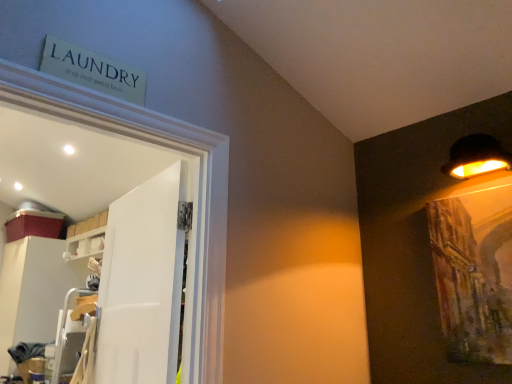
Question: Does white glossy cabinet at left contain white glossy shelf at upper left?

Choices:
 (A) yes
 (B) no

Answer: (B)

Question: Considering the relative positions of white glossy cabinet at left and white glossy shelf at upper left in the image provided, is white glossy cabinet at left to the right of white glossy shelf at upper left from the viewer's perspective?

Choices:
 (A) yes
 (B) no

Answer: (B)

Question: Considering the relative sizes of white glossy cabinet at left and white glossy shelf at upper left in the image provided, is white glossy cabinet at left shorter than white glossy shelf at upper left?

Choices:
 (A) no
 (B) yes

Answer: (A)

Question: Does white glossy cabinet at left have a greater height compared to white glossy shelf at upper left?

Choices:
 (A) yes
 (B) no

Answer: (A)

Question: Is white glossy cabinet at left smaller than white glossy shelf at upper left?

Choices:
 (A) yes
 (B) no

Answer: (B)

Question: From a real-world perspective, is white glossy cabinet at left on top of white glossy shelf at upper left?

Choices:
 (A) yes
 (B) no

Answer: (B)

Question: Can you confirm if white matte door at center is taller than black matte lampshade at upper right?

Choices:
 (A) yes
 (B) no

Answer: (A)

Question: Is white matte door at center to the right of black matte lampshade at upper right from the viewer's perspective?

Choices:
 (A) yes
 (B) no

Answer: (B)

Question: From a real-world perspective, is white matte door at center beneath black matte lampshade at upper right?

Choices:
 (A) no
 (B) yes

Answer: (B)

Question: Does white matte door at center lie in front of black matte lampshade at upper right?

Choices:
 (A) no
 (B) yes

Answer: (B)

Question: Does white matte door at center turn towards black matte lampshade at upper right?

Choices:
 (A) yes
 (B) no

Answer: (B)

Question: Does white matte door at center have a greater width compared to black matte lampshade at upper right?

Choices:
 (A) no
 (B) yes

Answer: (A)

Question: Does white glossy shelf at upper left appear on the left side of black matte lampshade at upper right?

Choices:
 (A) yes
 (B) no

Answer: (A)